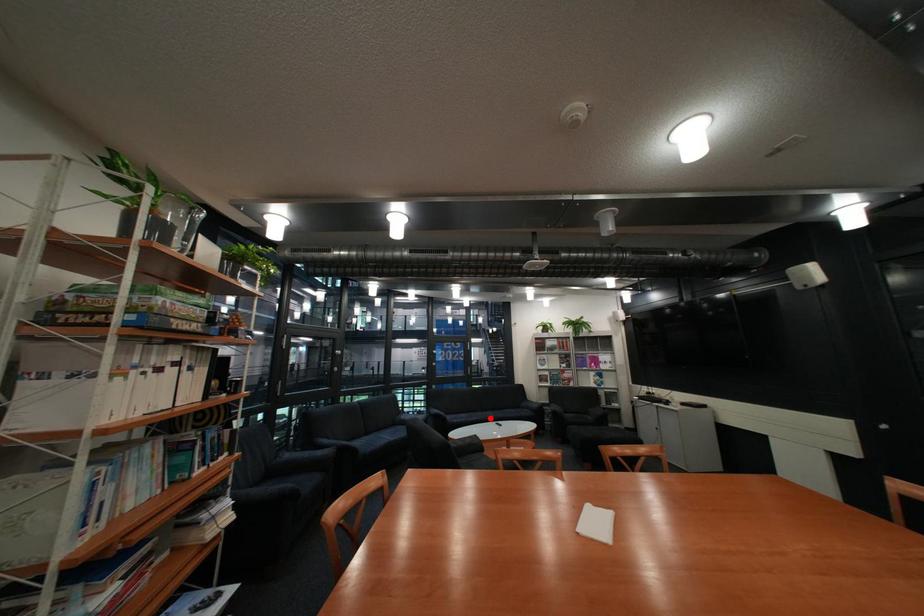
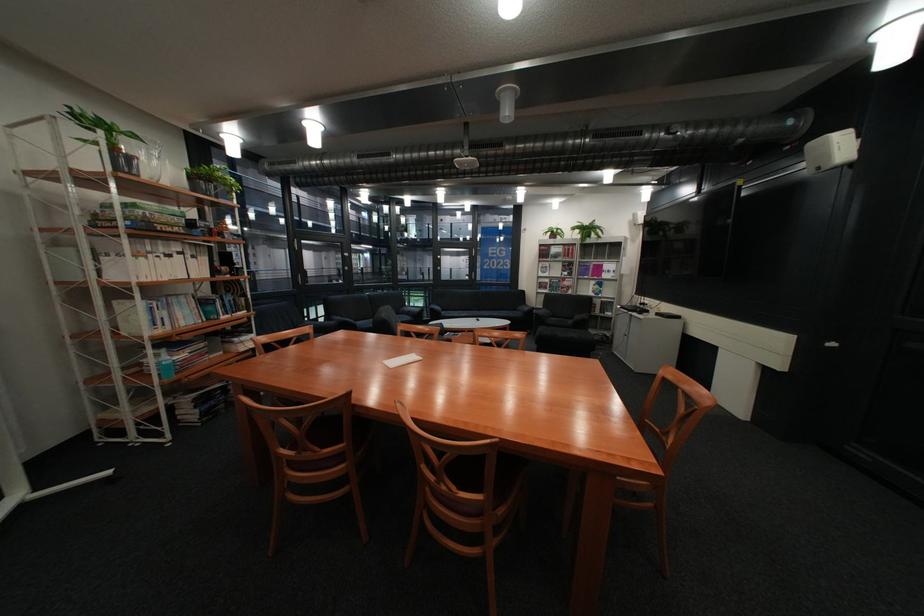
Question: I am providing you with two images of the same scene from different viewpoints. In image1, a red point is highlighted. Considering the same 3D point in image2, which of the following is correct?

Choices:
 (A) It is closer
 (B) It is farther

Answer: (B)